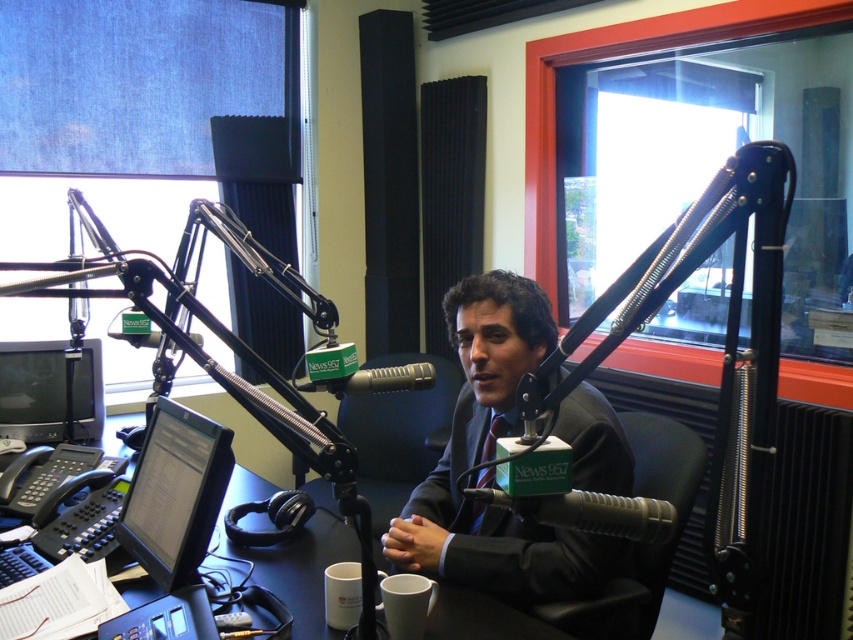
Question: Can you confirm if black plastic table at center is positioned above matte black tie at center?

Choices:
 (A) no
 (B) yes

Answer: (A)

Question: Considering the relative positions of dark gray suit at center and matte black microphone at center in the image provided, where is dark gray suit at center located with respect to matte black microphone at center?

Choices:
 (A) right
 (B) left

Answer: (B)

Question: Among these objects, which one is nearest to the camera?

Choices:
 (A) black plastic table at center
 (B) matte black microphone at center
 (C) black glossy monitor at center left

Answer: (B)

Question: Where is black plastic table at center located in relation to silver metallic microphone at center in the image?

Choices:
 (A) above
 (B) below

Answer: (B)

Question: Which object is farther from the camera taking this photo?

Choices:
 (A) matte black microphone at center
 (B) black plastic table at center
 (C) matte black monitor at left
 (D) matte black tie at center

Answer: (C)

Question: Which of the following is the farthest from the observer?

Choices:
 (A) matte black microphone at center
 (B) black plastic table at center

Answer: (B)